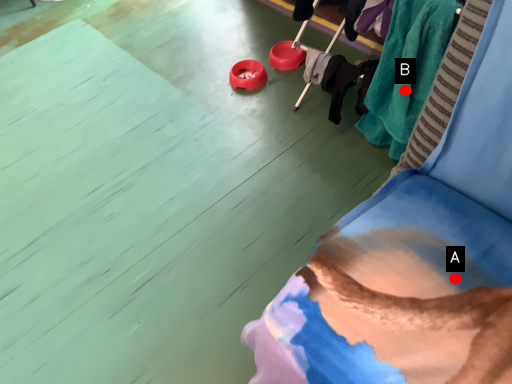
Question: Two points are circled on the image, labeled by A and B beside each circle. Which point is farther to the camera?

Choices:
 (A) A is further
 (B) B is further

Answer: (B)